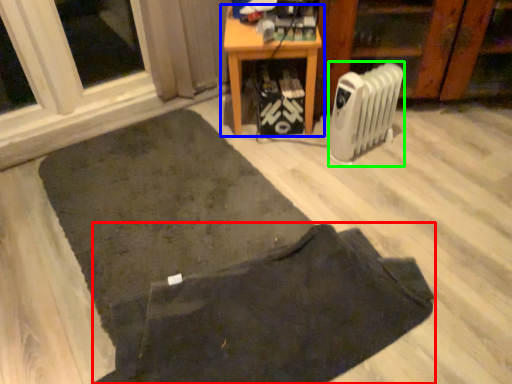
Question: Considering the real-world distances, which object is farthest from doormat (highlighted by a red box)? table (highlighted by a blue box) or radiator (highlighted by a green box)?

Choices:
 (A) table
 (B) radiator

Answer: (A)